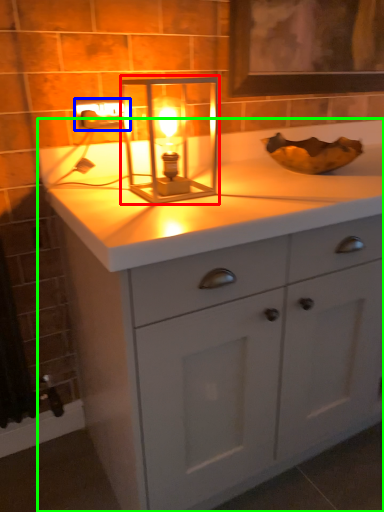
Question: Which object is the farthest from candle holder (highlighted by a red box)? Choose among these: electric outlet (highlighted by a blue box) or bathroom cabinet (highlighted by a green box).

Choices:
 (A) electric outlet
 (B) bathroom cabinet

Answer: (B)